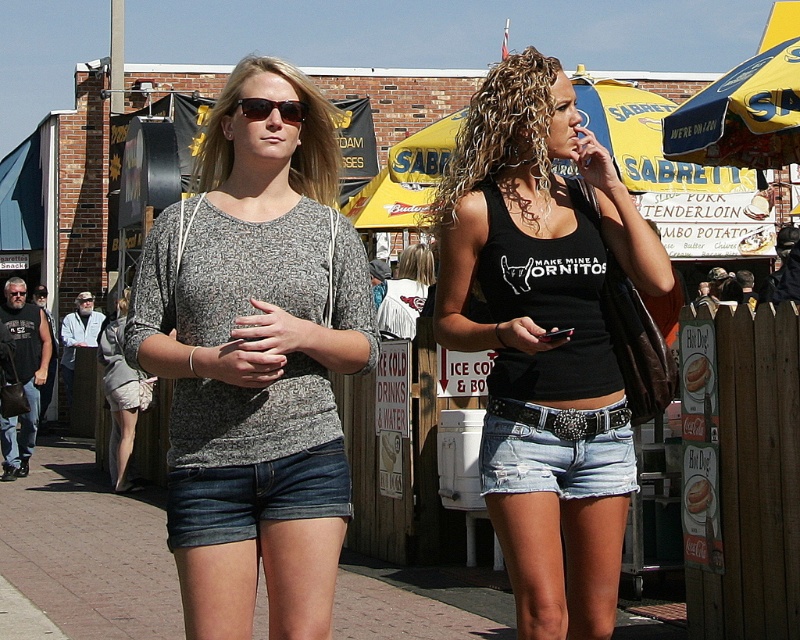
Question: Is gray heathered shirt at center wider than black matte tank top at center?

Choices:
 (A) yes
 (B) no

Answer: (B)

Question: Which point is farther from the camera taking this photo?

Choices:
 (A) (466, 124)
 (B) (320, 538)

Answer: (A)

Question: Which of the following is the farthest from the observer?

Choices:
 (A) (528, 580)
 (B) (268, 113)
 (C) (240, 556)

Answer: (B)

Question: Which point is farther to the camera?

Choices:
 (A) (530, 289)
 (B) (262, 93)
 (C) (270, 112)

Answer: (A)

Question: Does gray heathered shirt at center have a lesser width compared to matte black sunglasses at center?

Choices:
 (A) no
 (B) yes

Answer: (A)

Question: Can you confirm if black matte tank top at center is smaller than matte black sunglasses at center?

Choices:
 (A) yes
 (B) no

Answer: (B)